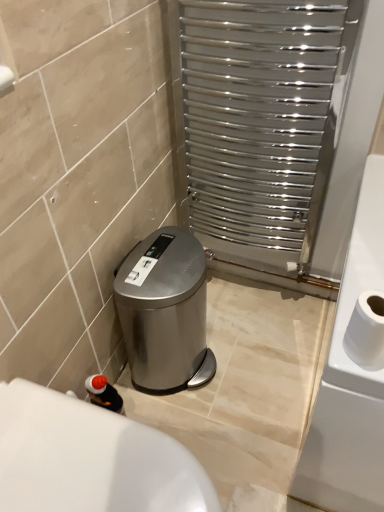
Question: Can you confirm if white glossy bath at lower left is bigger than satin silver trash can at lower left?

Choices:
 (A) no
 (B) yes

Answer: (B)

Question: Is white glossy bath at lower left positioned beyond the bounds of satin silver trash can at lower left?

Choices:
 (A) no
 (B) yes

Answer: (B)

Question: From a real-world perspective, is white glossy bath at lower left over satin silver trash can at lower left?

Choices:
 (A) yes
 (B) no

Answer: (A)

Question: Considering the relative sizes of white glossy bath at lower left and satin silver trash can at lower left in the image provided, is white glossy bath at lower left taller than satin silver trash can at lower left?

Choices:
 (A) yes
 (B) no

Answer: (B)

Question: Could you tell me if white glossy bath at lower left is facing satin silver trash can at lower left?

Choices:
 (A) no
 (B) yes

Answer: (A)

Question: Is white glossy bath at lower left positioned in front of satin silver trash can at lower left?

Choices:
 (A) yes
 (B) no

Answer: (A)

Question: Considering the relative sizes of white matte toilet paper at right and satin silver trash can at lower left in the image provided, is white matte toilet paper at right shorter than satin silver trash can at lower left?

Choices:
 (A) yes
 (B) no

Answer: (A)

Question: Considering the relative sizes of white matte toilet paper at right and satin silver trash can at lower left in the image provided, is white matte toilet paper at right bigger than satin silver trash can at lower left?

Choices:
 (A) no
 (B) yes

Answer: (A)

Question: From a real-world perspective, is white matte toilet paper at right positioned over satin silver trash can at lower left based on gravity?

Choices:
 (A) no
 (B) yes

Answer: (B)

Question: Does white matte toilet paper at right turn towards satin silver trash can at lower left?

Choices:
 (A) no
 (B) yes

Answer: (A)

Question: Is white matte toilet paper at right closer to camera compared to satin silver trash can at lower left?

Choices:
 (A) no
 (B) yes

Answer: (B)

Question: Can you confirm if white matte toilet paper at right is positioned to the right of satin silver trash can at lower left?

Choices:
 (A) no
 (B) yes

Answer: (B)

Question: Is polished stainless steel radiator at upper right outside of satin silver trash can at lower left?

Choices:
 (A) yes
 (B) no

Answer: (A)